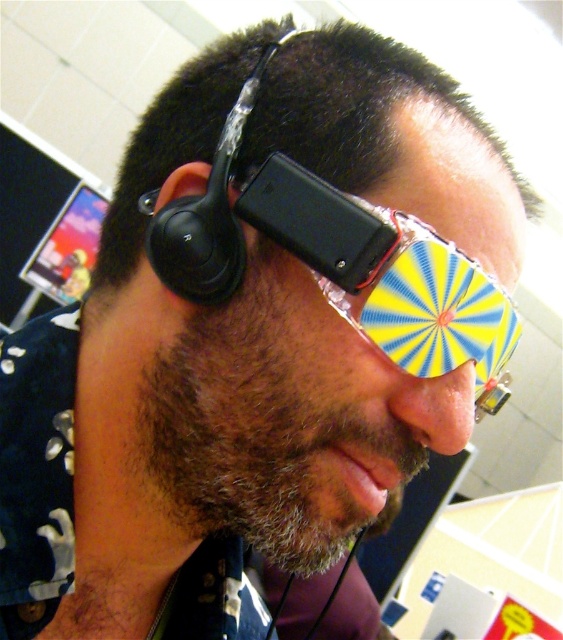
You are a customer trying to wear both the black matte earphone at left and the black matte earbud at upper left. Which one should you put in your ear first?

The black matte earphone at left is positioned on the right side of the black matte earbud at upper left, so you should put the black matte earbud at upper left in your ear first since it is on the left side.

You are a fashion designer analyzing accessories in the image. You need to determine the spatial arrangement of the translucent plastic goggles at center and the black matte earbud at upper left. Which accessory is positioned to the right side of the other?

The translucent plastic goggles at center is to the right of black matte earbud at upper left.

You are a customer trying to choose between the black matte earphone at left and the black matte earbud at upper left based on their size. Which one has a larger width?

The black matte earphone at left might be wider than black matte earbud at upper left according to the description.